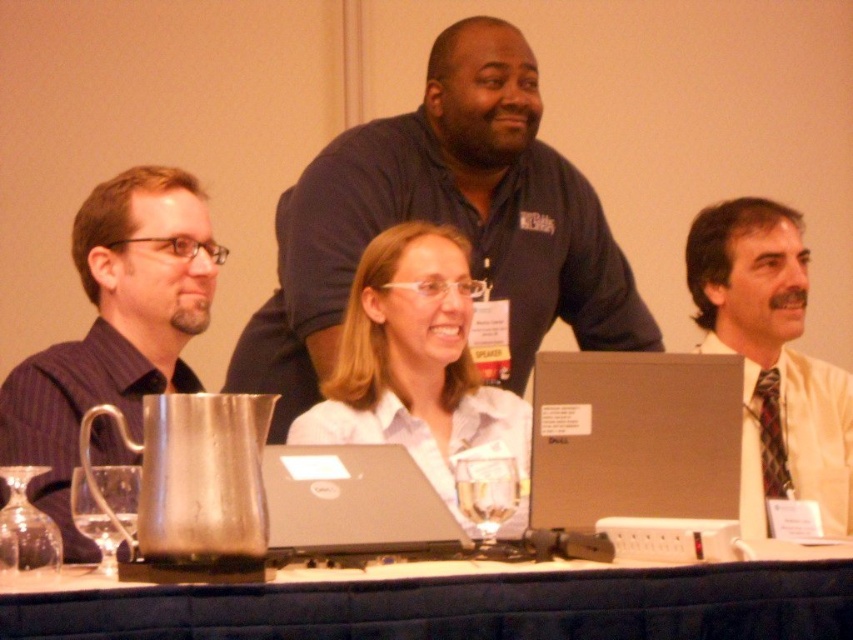
Question: Is black fabric table at lower center to the right of white shirt at center from the viewer's perspective?

Choices:
 (A) no
 (B) yes

Answer: (A)

Question: Among these objects, which one is farthest from the camera?

Choices:
 (A) black matte laptop at center
 (B) dark blue shirt at center

Answer: (B)

Question: Which object appears closest to the camera in this image?

Choices:
 (A) dark blue striped shirt at left
 (B) black matte laptop at center

Answer: (A)

Question: Is dark blue shirt at center thinner than white glossy shirt at center?

Choices:
 (A) no
 (B) yes

Answer: (A)

Question: Where is white shirt at center located in relation to black matte laptop at center in the image?

Choices:
 (A) left
 (B) right

Answer: (B)

Question: Which object is the closest to the black matte laptop at center?

Choices:
 (A) dark blue striped shirt at left
 (B) black fabric table at lower center
 (C) white shirt at center

Answer: (B)